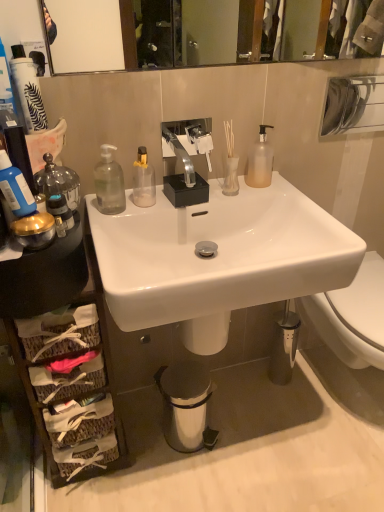
Where is `free area in between woven wood basket at lower left and metallic trash can at lower center`? This screenshot has width=384, height=512. free area in between woven wood basket at lower left and metallic trash can at lower center is located at coordinates (146, 434).